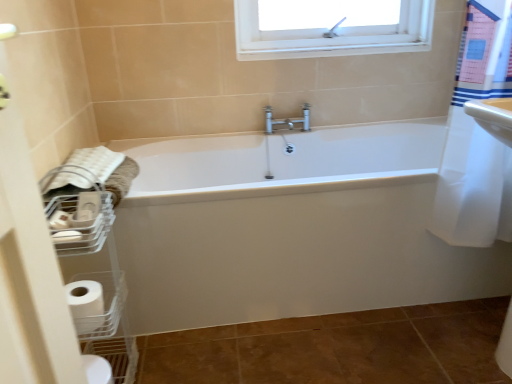
At what (x,y) coordinates should I click in order to perform the action: click on vacant area on top of brown matte ceramic tile at lower center (from a real-world perspective). Please return your answer as a coordinate pair (x, y). This screenshot has width=512, height=384. Looking at the image, I should click on [x=337, y=347].